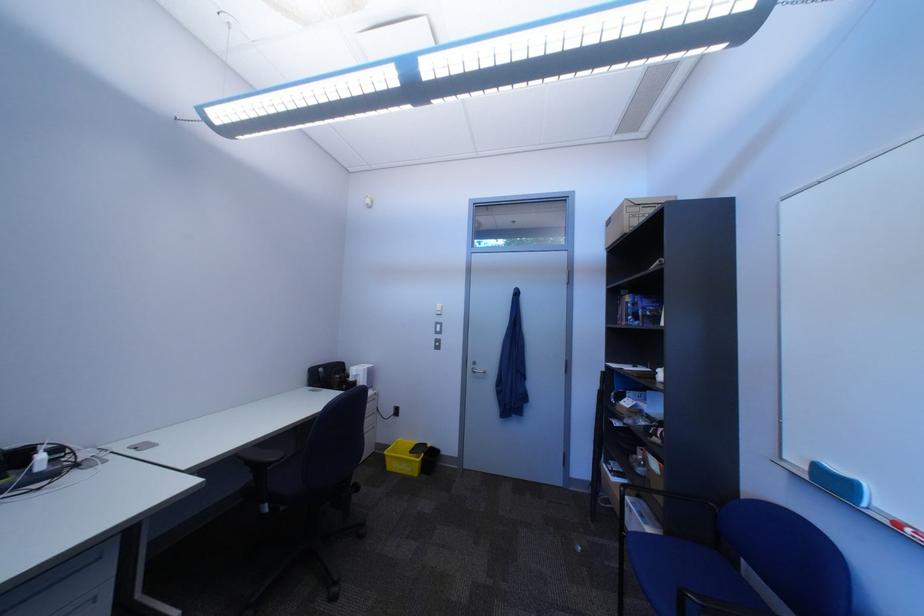
What do you see at coordinates (476, 368) in the screenshot? I see `the metal door hook` at bounding box center [476, 368].